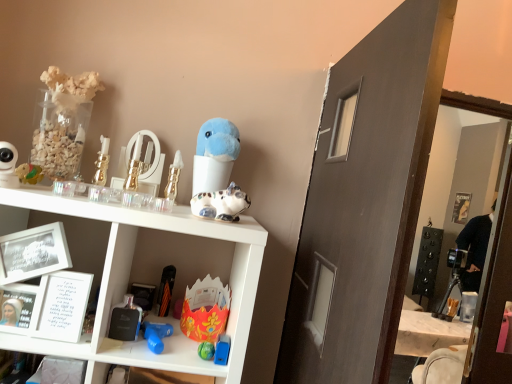
What is the approximate height of gold metallic candle at center, which is counted as the 9th toy, starting from the right?

gold metallic candle at center, which is counted as the 9th toy, starting from the right, is 7.95 inches tall.

What do you see at coordinates (33, 253) in the screenshot? I see `white matte picture frame at left` at bounding box center [33, 253].

The height and width of the screenshot is (384, 512). Describe the element at coordinates (206, 350) in the screenshot. I see `shiny green ball at lower center, which is counted as the 3th toy, starting from the right` at that location.

In order to click on blue rubber toy at lower center, acting as the fifth toy starting from the left in this screenshot , I will do `click(156, 335)`.

In order to face metallic gold perfume bottle at center, arranged as the sixth toy when viewed from the right, should I rotate leftwards or rightwards?

To align with it, rotate left about 10.763°.

Locate an element on the screen. This screenshot has width=512, height=384. gold metallic mirror at upper center is located at coordinates tap(144, 163).

Is matte white camera at left, the second toy from the left, taller or shorter than metallic gold perfume bottle at center, arranged as the sixth toy when viewed from the right?

Clearly, matte white camera at left, the second toy from the left, is shorter compared to metallic gold perfume bottle at center, arranged as the sixth toy when viewed from the right.

Does matte white camera at left, acting as the 10th toy starting from the right, come in front of metallic gold perfume bottle at center, arranged as the sixth toy when viewed from the right?

That is True.

Is matte white camera at left, the second toy from the left, facing towards metallic gold perfume bottle at center, arranged as the sixth toy when viewed from the right?

No, matte white camera at left, the second toy from the left, is not oriented towards metallic gold perfume bottle at center, arranged as the sixth toy when viewed from the right.

Are blue plastic toy at lower center, the 11th toy when ordered from left to right, and white glossy ceramic cat at center, placed as the 10th toy when sorted from left to right, far apart?

No, blue plastic toy at lower center, the 11th toy when ordered from left to right, is not far from white glossy ceramic cat at center, placed as the 10th toy when sorted from left to right.

Is blue plastic toy at lower center, the first toy when ordered from right to left, looking in the opposite direction of white glossy ceramic cat at center, the second toy viewed from the right?

blue plastic toy at lower center, the first toy when ordered from right to left, does not have its back to white glossy ceramic cat at center, the second toy viewed from the right.

Between point (217, 353) and point (226, 195), which one is positioned behind?

The point (217, 353) is more distant.

Is floral paper crown at center, which is the fifth toy in right-to-left order, oriented away from gold metallic mirror at upper center?

That's not correct — floral paper crown at center, which is the fifth toy in right-to-left order, is not looking away from gold metallic mirror at upper center.

From the image's perspective, would you say floral paper crown at center, which is the 7th toy in left-to-right order, is shown under gold metallic mirror at upper center?

Correct, floral paper crown at center, which is the 7th toy in left-to-right order, appears lower than gold metallic mirror at upper center in the image.

From a real-world perspective, between floral paper crown at center, which is the 7th toy in left-to-right order, and gold metallic mirror at upper center, who is vertically higher?

gold metallic mirror at upper center.

Is metallic gold perfume bottle at center, the 6th toy when ordered from left to right, situated inside blue plastic toy at lower center, the first toy when ordered from right to left, or outside?

The correct answer is: outside.

From a real-world perspective, is metallic gold perfume bottle at center, the 6th toy when ordered from left to right, on top of blue plastic toy at lower center, the 11th toy when ordered from left to right?

Yes.

Is the surface of metallic gold perfume bottle at center, arranged as the sixth toy when viewed from the right, in direct contact with blue plastic toy at lower center, the 11th toy when ordered from left to right?

No, metallic gold perfume bottle at center, arranged as the sixth toy when viewed from the right, is not touching blue plastic toy at lower center, the 11th toy when ordered from left to right.

Considering the sizes of objects metallic gold perfume bottle at center, arranged as the sixth toy when viewed from the right, and blue plastic toy at lower center, the 11th toy when ordered from left to right, in the image provided, who is thinner, metallic gold perfume bottle at center, arranged as the sixth toy when viewed from the right, or blue plastic toy at lower center, the 11th toy when ordered from left to right,?

blue plastic toy at lower center, the 11th toy when ordered from left to right, is thinner.

What's the angular difference between blue rubber toy at lower center, acting as the fifth toy starting from the left, and shiny plastic toy at left, positioned as the 11th toy in right-to-left order,'s facing directions?

The angle between the facing direction of blue rubber toy at lower center, acting as the fifth toy starting from the left, and the facing direction of shiny plastic toy at left, positioned as the 11th toy in right-to-left order, is 2.09 degrees.

Considering the sizes of objects blue rubber toy at lower center, acting as the fifth toy starting from the left, and shiny plastic toy at left, positioned as the 11th toy in right-to-left order, in the image provided, who is shorter, blue rubber toy at lower center, acting as the fifth toy starting from the left, or shiny plastic toy at left, positioned as the 11th toy in right-to-left order,?

blue rubber toy at lower center, acting as the fifth toy starting from the left.

Based on the photo, from a real-world perspective, which object rests below the other?

In real-world perspective, blue rubber toy at lower center, the seventh toy positioned from the right, is lower.

Is blue rubber toy at lower center, the seventh toy positioned from the right, bigger or smaller than shiny plastic toy at left, acting as the first toy starting from the left?

blue rubber toy at lower center, the seventh toy positioned from the right, is bigger than shiny plastic toy at left, acting as the first toy starting from the left.

Which object is more forward, white matte picture frame at left or blue plush toy at upper center, which is counted as the fourth toy, starting from the right?

white matte picture frame at left is in front.

Which is behind, point (3, 244) or point (221, 184)?

The point (221, 184) is farther from the camera.

In the scene shown: Is white matte picture frame at left directly adjacent to blue plush toy at upper center, which is counted as the fourth toy, starting from the right?

No, white matte picture frame at left is not with blue plush toy at upper center, which is counted as the fourth toy, starting from the right.

Which is more to the left, white matte picture frame at left or blue plush toy at upper center, which is counted as the fourth toy, starting from the right?

Positioned to the left is white matte picture frame at left.

Is metallic gold perfume bottle at center, the 6th toy when ordered from left to right, oriented away from white glossy ceramic cat at center, placed as the 10th toy when sorted from left to right?

No, white glossy ceramic cat at center, placed as the 10th toy when sorted from left to right, is not at the back of metallic gold perfume bottle at center, the 6th toy when ordered from left to right.

Is metallic gold perfume bottle at center, arranged as the sixth toy when viewed from the right, bigger or smaller than white glossy ceramic cat at center, placed as the 10th toy when sorted from left to right?

metallic gold perfume bottle at center, arranged as the sixth toy when viewed from the right, is smaller than white glossy ceramic cat at center, placed as the 10th toy when sorted from left to right.

From the image's perspective, count 1st toys upward from the metallic gold perfume bottle at center, arranged as the sixth toy when viewed from the right, and point to it. Please provide its 2D coordinates.

[(8, 165)]

What are the coordinates of `the 5th toy below when counting from the white glossy ceramic cat at center, placed as the 10th toy when sorted from left to right (from the image's perspective)` in the screenshot? It's located at [x=222, y=350].

From the image, which object appears to be nearer to orange matte umbrella at lower center, positioned as the 8th toy in right-to-left order, gold metallic candle at center, which is counted as the 9th toy, starting from the right, or matte black shelf at lower left?

The object closer to orange matte umbrella at lower center, positioned as the 8th toy in right-to-left order, is matte black shelf at lower left.

Considering their positions, is matte black shelf at lower left positioned further to matte white camera at left, the second toy from the left, than white glossy ceramic cat at center, placed as the 10th toy when sorted from left to right?

white glossy ceramic cat at center, placed as the 10th toy when sorted from left to right, is further to matte white camera at left, the second toy from the left.

Estimate the real-world distances between objects in this image. Which object is closer to blue rubber toy at lower center, the seventh toy positioned from the right, orange matte umbrella at lower center, placed as the fourth toy when sorted from left to right, or shiny green ball at lower center, which is counted as the 3th toy, starting from the right?

Based on the image, shiny green ball at lower center, which is counted as the 3th toy, starting from the right, appears to be nearer to blue rubber toy at lower center, the seventh toy positioned from the right.

Based on the photo, from the image, which object appears to be farther from orange matte umbrella at lower center, positioned as the 8th toy in right-to-left order, shiny plastic toy at left, positioned as the 11th toy in right-to-left order, or white matte picture frame at left?

shiny plastic toy at left, positioned as the 11th toy in right-to-left order.

Considering their positions, is gold metallic mirror at upper center positioned closer to white glossy ceramic cat at center, the second toy viewed from the right, than matte brown door at center?

gold metallic mirror at upper center is closer to white glossy ceramic cat at center, the second toy viewed from the right.

Considering their positions, is shiny plastic toy at left, positioned as the 11th toy in right-to-left order, positioned further to gold metallic candle at center, which is counted as the 9th toy, starting from the right, than matte brown door at center?

matte brown door at center is further to gold metallic candle at center, which is counted as the 9th toy, starting from the right.

Which object lies further to the anchor point white glossy ceramic cat at center, the second toy viewed from the right, matte white camera at left, the second toy from the left, or shiny green ball at lower center, marked as the ninth toy in a left-to-right arrangement?

Among the two, matte white camera at left, the second toy from the left, is located further to white glossy ceramic cat at center, the second toy viewed from the right.

When comparing their distances from white matte picture frame at left, does gold metallic mirror at upper center or blue plush toy at upper center, which is counted as the fourth toy, starting from the right, seem closer?

Among the two, gold metallic mirror at upper center is located nearer to white matte picture frame at left.

The height and width of the screenshot is (384, 512). I want to click on mirror located between shiny plastic toy at left, acting as the first toy starting from the left, and matte brown door at center in the left-right direction, so 144,163.

I want to click on picture frame situated between shiny plastic toy at left, acting as the first toy starting from the left, and blue plastic toy at lower center, the 11th toy when ordered from left to right, from left to right, so click(33, 253).

Locate an element on the screen. picture frame between gold metallic candle at center, which is counted as the 9th toy, starting from the right, and blue rubber toy at lower center, acting as the fifth toy starting from the left, in the up-down direction is located at coordinates (33, 253).

Locate an element on the screen. picture frame positioned between matte white camera at left, the second toy from the left, and gold metallic mirror at upper center from near to far is located at coordinates (33, 253).